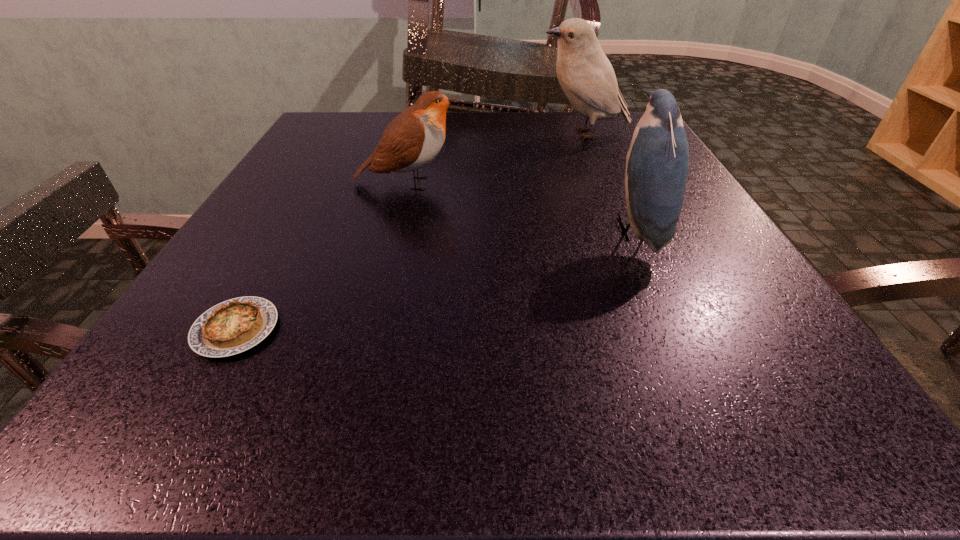
The width and height of the screenshot is (960, 540). In order to click on vacant space at the left edge in this screenshot , I will do `click(205, 272)`.

Find the location of a particular element. Image resolution: width=960 pixels, height=540 pixels. vacant space at the right edge of the desktop is located at coordinates (619, 201).

This screenshot has width=960, height=540. I want to click on vacant space at the far left corner, so click(x=324, y=120).

This screenshot has height=540, width=960. Find the location of `free spot at the far right corner of the desktop`. free spot at the far right corner of the desktop is located at coordinates (602, 148).

Where is `empty space between the leftmost bird and the farthest bird`? empty space between the leftmost bird and the farthest bird is located at coordinates (495, 158).

Locate an element on the screen. free space between the shortest bird and the leftmost object is located at coordinates (322, 256).

Find the location of a particular element. The height and width of the screenshot is (540, 960). empty space that is in between the quiche and the shortest bird is located at coordinates (322, 256).

In order to click on free area in between the quiche and the nearest bird in this screenshot , I will do `click(436, 280)`.

Where is `empty space that is in between the shortest bird and the third farthest object`? This screenshot has height=540, width=960. empty space that is in between the shortest bird and the third farthest object is located at coordinates (521, 207).

Where is `blank region between the farthest bird and the second shortest object`? Image resolution: width=960 pixels, height=540 pixels. blank region between the farthest bird and the second shortest object is located at coordinates (495, 158).